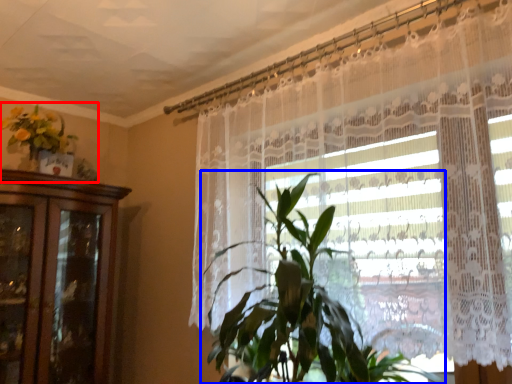
Question: Which point is closer to the camera, floral arrangement (highlighted by a red box) or houseplant (highlighted by a blue box)?

Choices:
 (A) floral arrangement
 (B) houseplant

Answer: (B)